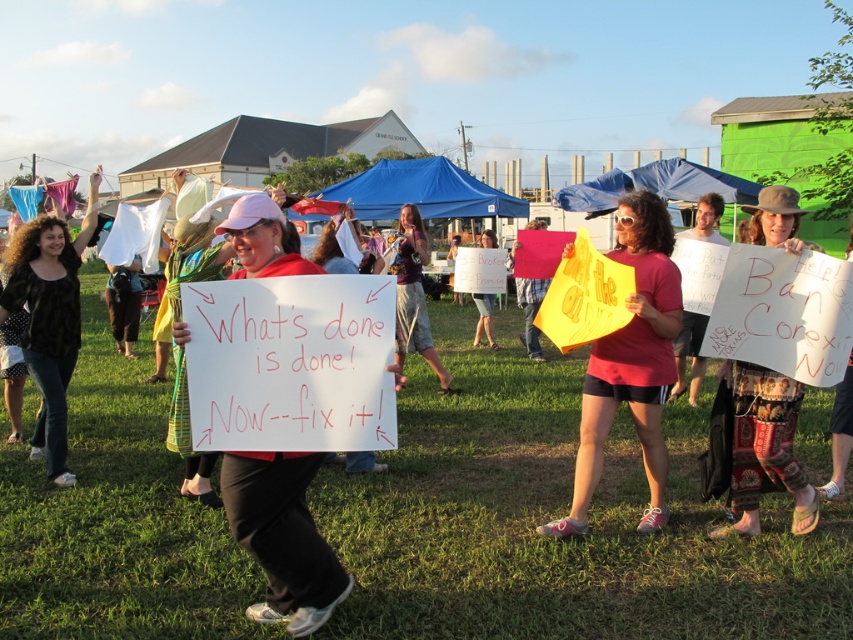
Who is shorter, matte yellow sign at center or maroon fabric shirt at center?

matte yellow sign at center

Is point (653, 435) closer to camera compared to point (409, 282)?

Yes, it is.

In order to click on matte yellow sign at center in this screenshot , I will do `click(631, 364)`.

Is green grass at center taller than printed fabric sign at center?

No.

How distant is green grass at center from printed fabric sign at center?

green grass at center is 7.11 feet away from printed fabric sign at center.

Between point (479, 609) and point (750, 524), which one is positioned behind?

The point (750, 524) is behind.

Identify the location of green grass at center. (555, 516).

Is white paper sign at center closer to camera compared to matte yellow sign at center?

Yes, white paper sign at center is in front of matte yellow sign at center.

Does white paper sign at center appear under matte yellow sign at center?

Yes.

Identify the location of white paper sign at center. The image size is (853, 640). (282, 536).

Identify the location of white paper sign at center. (282, 536).